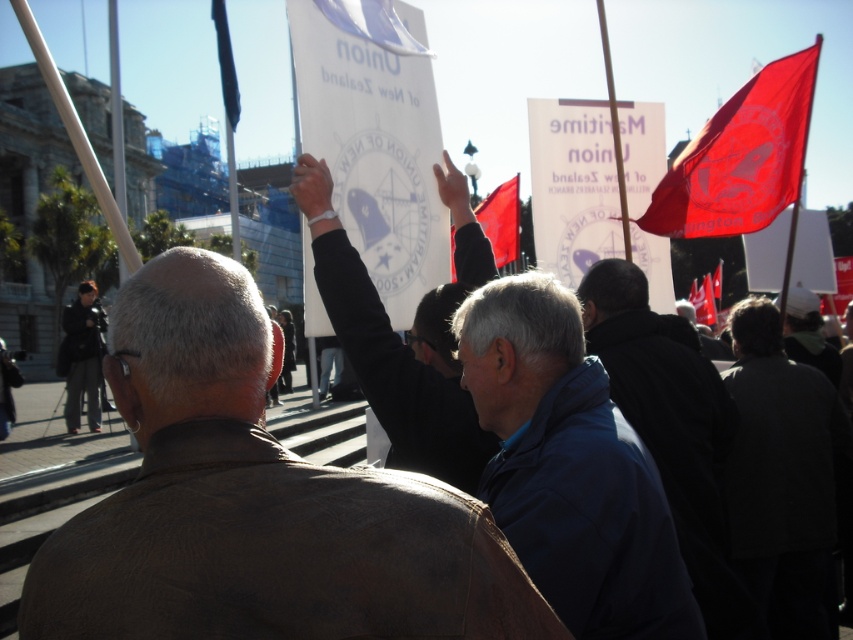
You are a photographer standing at the dark blue jacket at center position. You want to capture a photo of the blue fabric flag at upper left without moving. Can you see the flag clearly from your current position?

The distance between dark blue jacket at center and blue fabric flag at upper left is 99.11 feet, so yes, you can see the flag clearly from your current position as there is no obstruction mentioned in the scene description.

Based on the scene description, can you determine the relative position of the dark gray jacket at lower right and dark gray jacket at lower left? Specifically, which one is positioned to the right side of the image?

The dark gray jacket at lower right is positioned to the right of the dark gray jacket at lower left, so the dark gray jacket at lower right is on the right side of the image.